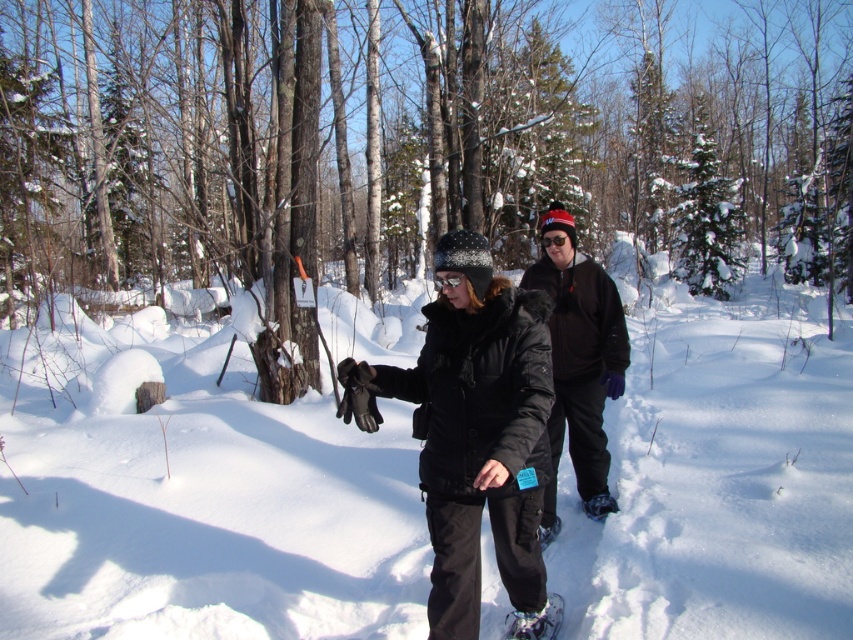
Question: Considering the real-world distances, which object is farthest from the white fluffy snow at center?

Choices:
 (A) black fleece jacket at center
 (B) white mesh snowshoe at lower center
 (C) smooth bark tree at center

Answer: (C)

Question: Is white mesh snowshoe at lower center to the left of white textured snowshoe at lower center from the viewer's perspective?

Choices:
 (A) no
 (B) yes

Answer: (B)

Question: Which point appears farthest from the camera in this image?

Choices:
 (A) (61, 33)
 (B) (590, 500)

Answer: (A)

Question: Estimate the real-world distances between objects in this image. Which object is farther from the white textured snowshoe at lower center?

Choices:
 (A) white fluffy snow at center
 (B) black fleece jacket at center

Answer: (A)

Question: Does black matte jacket at center appear on the right side of white mesh snowshoe at lower center?

Choices:
 (A) yes
 (B) no

Answer: (B)

Question: Is black matte jacket at center to the left of black fleece jacket at center from the viewer's perspective?

Choices:
 (A) no
 (B) yes

Answer: (B)